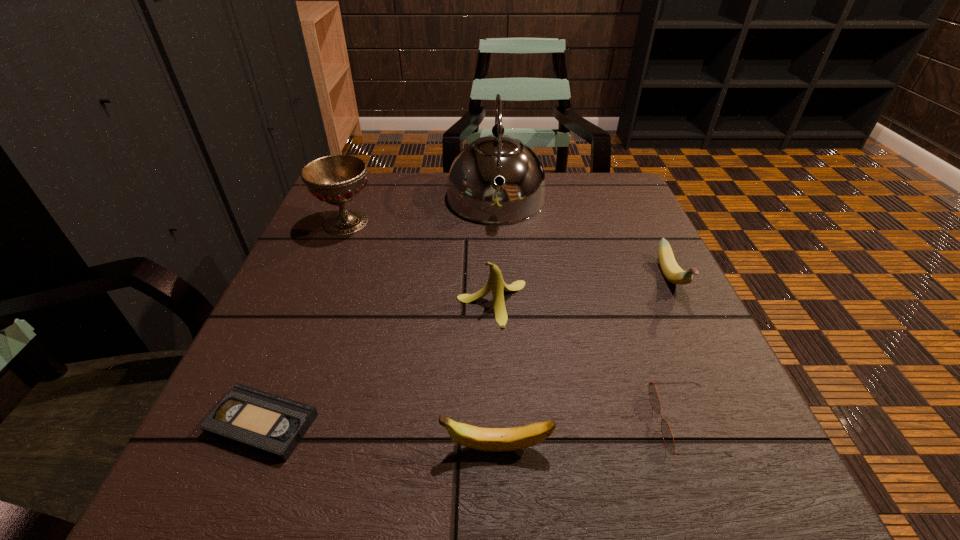
Find the location of a particular element. This screenshot has height=540, width=960. vacant space situated 0.310m on the left of the tallest banana is located at coordinates tap(294, 303).

What are the coordinates of `vacant space located at the stem of the rightmost object` in the screenshot? It's located at (737, 414).

Identify the location of vacant area situated 0.320m at the stem of the nearest banana. pyautogui.click(x=214, y=448).

What are the coordinates of `vacant space located at the stem of the nearest banana` in the screenshot? It's located at (328, 448).

The width and height of the screenshot is (960, 540). Identify the location of free region located at the stem of the nearest banana. (214, 448).

Locate an element on the screen. vacant position located on the face of the sunglasses is located at coordinates (406, 423).

This screenshot has height=540, width=960. In order to click on free space located on the face of the sunglasses in this screenshot , I will do `click(563, 423)`.

The height and width of the screenshot is (540, 960). I want to click on vacant space located 0.320m on the face of the sunglasses, so click(441, 423).

The height and width of the screenshot is (540, 960). Find the location of `blank area located on the right of the videotape`. blank area located on the right of the videotape is located at coordinates click(x=370, y=424).

Find the location of a particular element. The image size is (960, 540). kettle positioned at the far edge is located at coordinates (472, 193).